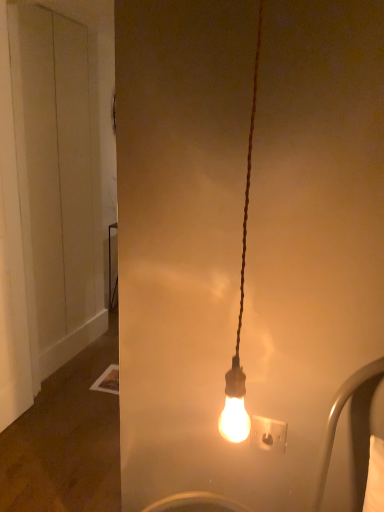
The height and width of the screenshot is (512, 384). Describe the element at coordinates (268, 434) in the screenshot. I see `white plastic socket at center` at that location.

Where is `white plastic socket at center`? The image size is (384, 512). white plastic socket at center is located at coordinates (268, 434).

What is the approximate width of white plastic socket at center?

1.17 inches.

What is the approximate height of white matte door at left?

white matte door at left is 6.65 feet tall.

At what (x,y) coordinates should I click in order to perform the action: click on white matte door at left. Please return your answer as a coordinate pair (x, y). Looking at the image, I should click on (57, 182).

This screenshot has width=384, height=512. Describe the element at coordinates (57, 182) in the screenshot. I see `white matte door at left` at that location.

Image resolution: width=384 pixels, height=512 pixels. I want to click on white plastic socket at center, so click(268, 434).

Based on their positions, is white matte door at left located to the left or right of white plastic socket at center?

Based on their positions, white matte door at left is located to the left of white plastic socket at center.

Is white matte door at left positioned in front of white plastic socket at center?

No, white matte door at left is further to the viewer.

Between point (30, 134) and point (273, 439), which one is positioned in front?

The point (273, 439) is more forward.

From the image's perspective, is white matte door at left above or below white plastic socket at center?

From the image's perspective, white matte door at left appears above white plastic socket at center.

From a real-world perspective, which object rests below the other?

white plastic socket at center, from a real-world perspective.

Is white matte door at left wider than white plastic socket at center?

Yes, white matte door at left is wider than white plastic socket at center.

Who is taller, white matte door at left or white plastic socket at center?

white matte door at left is taller.

Considering the sizes of white matte door at left and white plastic socket at center in the image, is white matte door at left bigger or smaller than white plastic socket at center?

white matte door at left is bigger than white plastic socket at center.

Would you say white matte door at left is outside white plastic socket at center?

Yes.

Is white matte door at left positioned far away from white plastic socket at center?

Indeed, white matte door at left is not near white plastic socket at center.

Does white matte door at left turn towards white plastic socket at center?

No, white matte door at left is not oriented towards white plastic socket at center.

Consider the image. What's the angular difference between white matte door at left and white plastic socket at center's facing directions?

0.948 degrees separate the facing orientations of white matte door at left and white plastic socket at center.

Where is `power plugs and sockets below the white matte door at left (from a real-world perspective)`? power plugs and sockets below the white matte door at left (from a real-world perspective) is located at coordinates (268, 434).

Is white plastic socket at center at the left side of white matte door at left?

In fact, white plastic socket at center is to the right of white matte door at left.

Between white plastic socket at center and white matte door at left, which one is positioned in front?

white plastic socket at center is more forward.

Considering the positions of point (255, 436) and point (78, 118), is point (255, 436) closer or farther from the camera than point (78, 118)?

Clearly, point (255, 436) is closer to the camera than point (78, 118).

From the image's perspective, between white plastic socket at center and white matte door at left, who is located below?

white plastic socket at center, from the image's perspective.

From a real-world perspective, does white plastic socket at center stand above white matte door at left?

Incorrect, from a real-world perspective, white plastic socket at center is lower than white matte door at left.

Between white plastic socket at center and white matte door at left, which one has larger width?

white matte door at left is wider.

Which of these two, white plastic socket at center or white matte door at left, stands shorter?

white plastic socket at center is shorter.

Consider the image. Considering the sizes of white plastic socket at center and white matte door at left in the image, is white plastic socket at center bigger or smaller than white matte door at left?

In the image, white plastic socket at center appears to be smaller than white matte door at left.

Is white matte door at left a part of white plastic socket at center?

That's incorrect, white matte door at left is not inside white plastic socket at center.

Is white plastic socket at center not close to white matte door at left?

white plastic socket at center is far away from white matte door at left.

Is white plastic socket at center facing away from white matte door at left?

white plastic socket at center does not have its back to white matte door at left.

This screenshot has width=384, height=512. In order to click on power plugs and sockets below the white matte door at left (from the image's perspective) in this screenshot , I will do `click(268, 434)`.

Locate an element on the screen. door behind the white plastic socket at center is located at coordinates (57, 182).

Where is `power plugs and sockets that appears in front of the white matte door at left`? Image resolution: width=384 pixels, height=512 pixels. power plugs and sockets that appears in front of the white matte door at left is located at coordinates (268, 434).